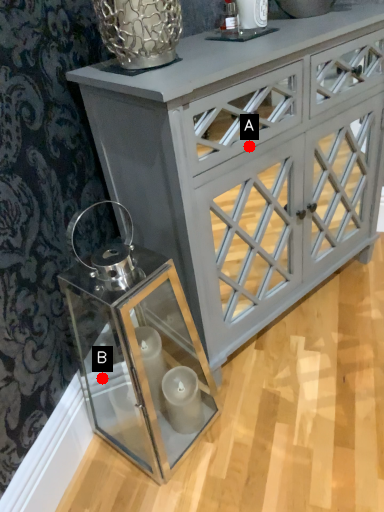
Question: Two points are circled on the image, labeled by A and B beside each circle. Which point is closer to the camera?

Choices:
 (A) A is closer
 (B) B is closer

Answer: (A)